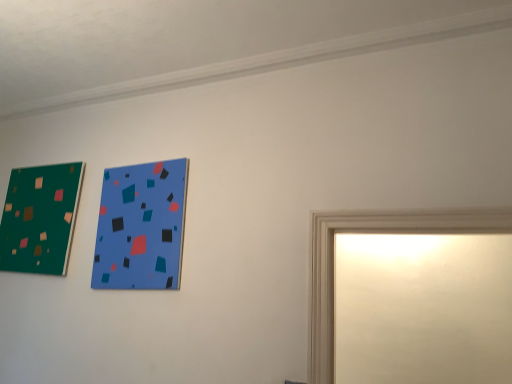
Question: Is blue matte picture frame at upper center, the 2th picture frame viewed from the back, shorter than matte green picture frame at upper left, the 1th picture frame viewed from the back?

Choices:
 (A) yes
 (B) no

Answer: (B)

Question: Are blue matte picture frame at upper center, marked as the 1th picture frame in a front-to-back arrangement, and matte green picture frame at upper left, the second picture frame in the right-to-left sequence, beside each other?

Choices:
 (A) no
 (B) yes

Answer: (A)

Question: Is the position of blue matte picture frame at upper center, the 1th picture frame positioned from the right, more distant than that of matte green picture frame at upper left, placed as the 1th picture frame when sorted from left to right?

Choices:
 (A) yes
 (B) no

Answer: (B)

Question: From the image's perspective, is blue matte picture frame at upper center, the 2th picture frame viewed from the back, under matte green picture frame at upper left, placed as the 1th picture frame when sorted from left to right?

Choices:
 (A) no
 (B) yes

Answer: (B)

Question: Could you tell me if blue matte picture frame at upper center, the 2th picture frame viewed from the back, is facing matte green picture frame at upper left, the second picture frame positioned from the front?

Choices:
 (A) no
 (B) yes

Answer: (A)

Question: Is the depth of blue matte picture frame at upper center, the second picture frame positioned from the left, less than that of matte green picture frame at upper left, the second picture frame positioned from the front?

Choices:
 (A) yes
 (B) no

Answer: (A)

Question: Does matte green picture frame at upper left, the second picture frame in the right-to-left sequence, have a smaller size compared to blue matte picture frame at upper center, the 2th picture frame viewed from the back?

Choices:
 (A) no
 (B) yes

Answer: (A)

Question: Is matte green picture frame at upper left, placed as the 1th picture frame when sorted from left to right, at the right side of blue matte picture frame at upper center, the second picture frame positioned from the left?

Choices:
 (A) yes
 (B) no

Answer: (B)

Question: Does matte green picture frame at upper left, the second picture frame in the right-to-left sequence, have a lesser height compared to blue matte picture frame at upper center, the second picture frame positioned from the left?

Choices:
 (A) yes
 (B) no

Answer: (A)

Question: Is matte green picture frame at upper left, placed as the 1th picture frame when sorted from left to right, beside blue matte picture frame at upper center, the second picture frame positioned from the left?

Choices:
 (A) no
 (B) yes

Answer: (A)

Question: Could you tell me if matte green picture frame at upper left, the second picture frame in the right-to-left sequence, is facing blue matte picture frame at upper center, the 1th picture frame positioned from the right?

Choices:
 (A) no
 (B) yes

Answer: (A)

Question: Is the position of matte green picture frame at upper left, the 1th picture frame viewed from the back, less distant than that of blue matte picture frame at upper center, the second picture frame positioned from the left?

Choices:
 (A) yes
 (B) no

Answer: (B)

Question: Would you say matte green picture frame at upper left, the second picture frame positioned from the front, is inside or outside blue matte picture frame at upper center, the 2th picture frame viewed from the back?

Choices:
 (A) inside
 (B) outside

Answer: (B)